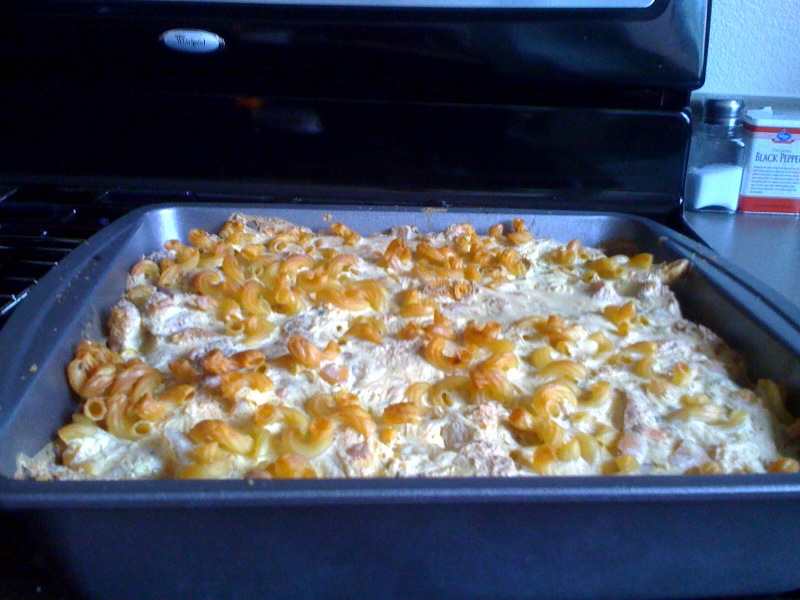
Where is `wall`? This screenshot has width=800, height=600. wall is located at coordinates (730, 78), (781, 78).